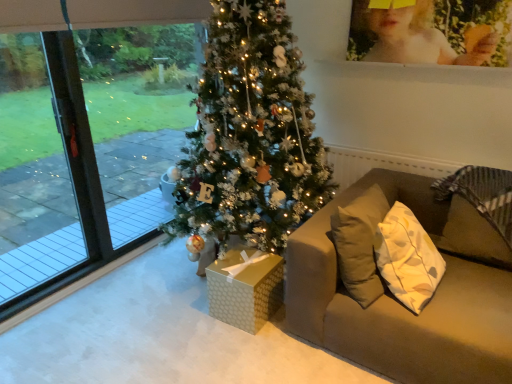
Question: Should I look upward or downward to see matte brown couch at right?

Choices:
 (A) up
 (B) down

Answer: (B)

Question: Is matte yellow photo frame at upper right oriented away from transparent glass screen door at left?

Choices:
 (A) no
 (B) yes

Answer: (A)

Question: Considering the relative sizes of matte yellow photo frame at upper right and transparent glass screen door at left in the image provided, is matte yellow photo frame at upper right shorter than transparent glass screen door at left?

Choices:
 (A) no
 (B) yes

Answer: (B)

Question: From a real-world perspective, does matte yellow photo frame at upper right stand above transparent glass screen door at left?

Choices:
 (A) yes
 (B) no

Answer: (A)

Question: From the image's perspective, would you say matte yellow photo frame at upper right is positioned over transparent glass screen door at left?

Choices:
 (A) yes
 (B) no

Answer: (A)

Question: Is matte yellow photo frame at upper right positioned in front of transparent glass screen door at left?

Choices:
 (A) yes
 (B) no

Answer: (B)

Question: Would you say matte yellow photo frame at upper right is a long distance from transparent glass screen door at left?

Choices:
 (A) no
 (B) yes

Answer: (B)

Question: Can you confirm if transparent glass screen door at left is wider than gold textured gift box at center?

Choices:
 (A) yes
 (B) no

Answer: (B)

Question: Considering the relative sizes of transparent glass screen door at left and gold textured gift box at center in the image provided, is transparent glass screen door at left bigger than gold textured gift box at center?

Choices:
 (A) no
 (B) yes

Answer: (B)

Question: Is transparent glass screen door at left looking in the opposite direction of gold textured gift box at center?

Choices:
 (A) yes
 (B) no

Answer: (B)

Question: From the image's perspective, is transparent glass screen door at left on gold textured gift box at center?

Choices:
 (A) yes
 (B) no

Answer: (A)

Question: Is the position of transparent glass screen door at left more distant than that of gold textured gift box at center?

Choices:
 (A) no
 (B) yes

Answer: (A)

Question: From a real-world perspective, is transparent glass screen door at left on top of gold textured gift box at center?

Choices:
 (A) no
 (B) yes

Answer: (B)

Question: From a real-world perspective, is matte brown couch at right beneath transparent glass window at left?

Choices:
 (A) no
 (B) yes

Answer: (B)